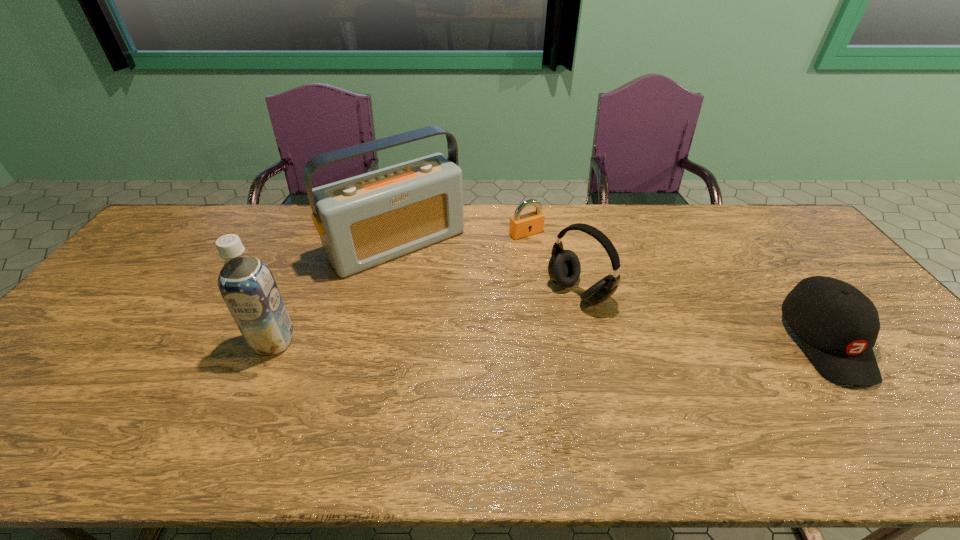
Identify the location of vacant space in between the radio receiver and the soya milk. The width and height of the screenshot is (960, 540). (336, 293).

Locate an element on the screen. This screenshot has width=960, height=540. the second closest object to the radio receiver is located at coordinates coord(247,286).

Find the location of a particular element. The image size is (960, 540). object that is the third nearest to the radio receiver is located at coordinates point(564,268).